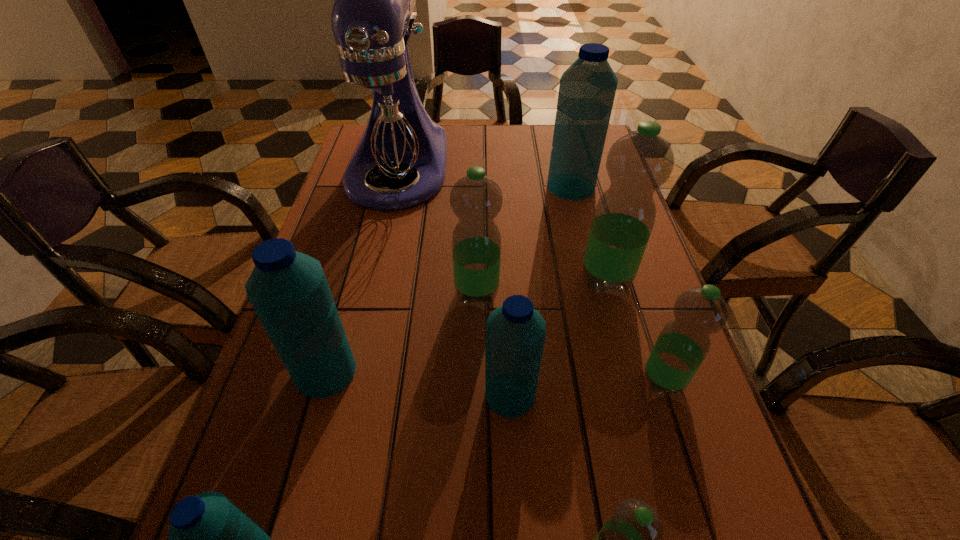
The height and width of the screenshot is (540, 960). In order to click on blue mixer in this screenshot , I will do `click(382, 119)`.

The height and width of the screenshot is (540, 960). I want to click on the tallest object, so click(382, 119).

Where is `the biggest blue water bottle`? The image size is (960, 540). the biggest blue water bottle is located at coordinates (587, 89).

This screenshot has height=540, width=960. In order to click on the farthest blue water bottle in this screenshot , I will do `click(587, 89)`.

Find the location of a particular element. The height and width of the screenshot is (540, 960). the biggest green water bottle is located at coordinates (638, 163).

Find the location of a particular element. The image size is (960, 540). the leftmost green water bottle is located at coordinates [x=476, y=199].

Locate an element on the screen. This screenshot has width=960, height=540. the third smallest blue water bottle is located at coordinates (288, 290).

This screenshot has width=960, height=540. In order to click on the second nearest green water bottle in this screenshot , I will do `click(683, 344)`.

Find the location of a particular element. the second smallest blue water bottle is located at coordinates (515, 335).

Identify the location of free space located 0.300m at the mixing area of the tallest object. (363, 314).